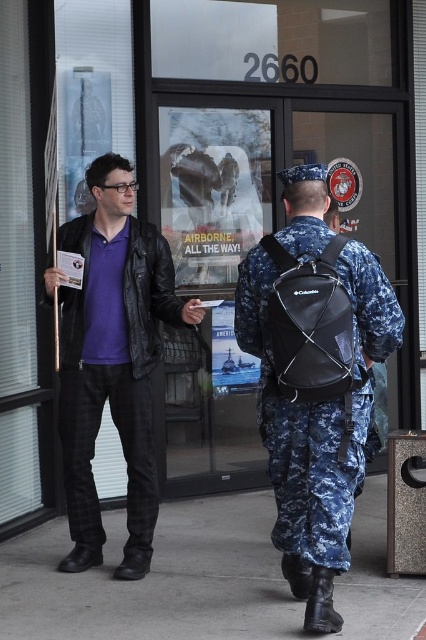
Question: Can you confirm if matte black jacket at center is thinner than navy blue camouflage uniform at right?

Choices:
 (A) no
 (B) yes

Answer: (A)

Question: Which point is closer to the camera?

Choices:
 (A) gray concrete pavement at lower center
 (B) navy blue camouflage uniform at right
 (C) matte black jacket at center

Answer: (A)

Question: Is matte black jacket at center smaller than navy blue camouflage uniform at right?

Choices:
 (A) no
 (B) yes

Answer: (A)

Question: Which point is farther to the camera?

Choices:
 (A) navy blue camouflage uniform at right
 (B) gray concrete pavement at lower center

Answer: (A)

Question: Does gray concrete pavement at lower center have a greater width compared to navy blue camouflage uniform at right?

Choices:
 (A) no
 (B) yes

Answer: (B)

Question: Which of the following is the closest to the observer?

Choices:
 (A) matte black jacket at center
 (B) navy blue camouflage uniform at right
 (C) gray concrete pavement at lower center

Answer: (C)